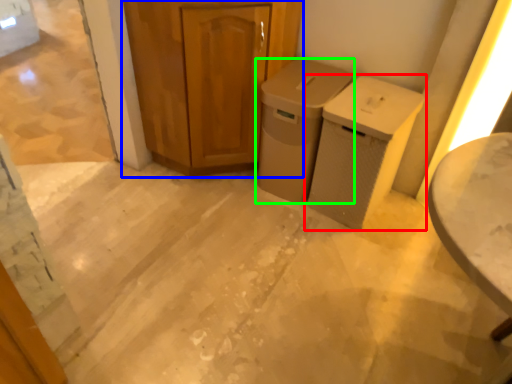
Question: Which object is the closest to the waste container (highlighted by a red box)? Choose among these: cabinetry (highlighted by a blue box) or waste container (highlighted by a green box).

Choices:
 (A) cabinetry
 (B) waste container

Answer: (B)